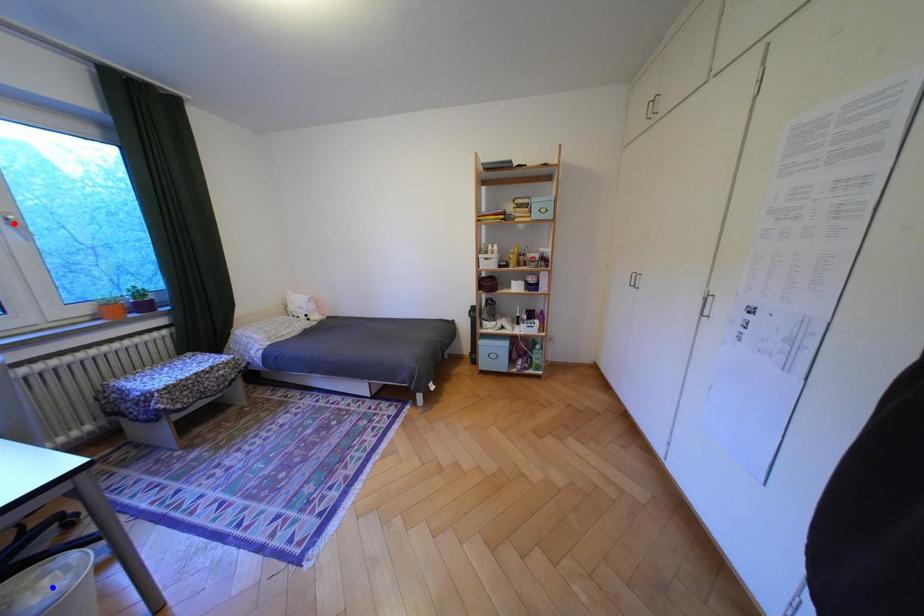
Question: In the image, two points are highlighted. Which point is nearer to the camera? Reply with the corresponding letter.

Choices:
 (A) blue point
 (B) red point

Answer: (A)